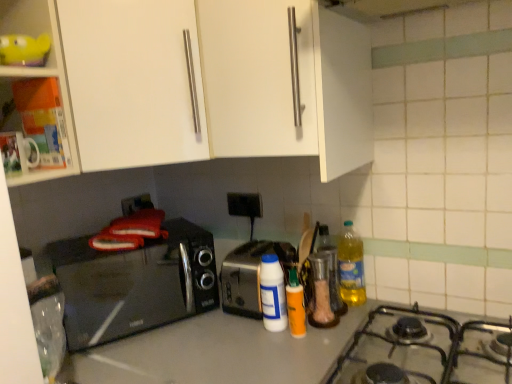
Question: From a real-world perspective, is orange matte bottle at center, the second bottle from the right, positioned above or below yellow translucent bottle at right?

Choices:
 (A) below
 (B) above

Answer: (A)

Question: Considering the positions of point (295, 307) and point (339, 248), is point (295, 307) closer or farther from the camera than point (339, 248)?

Choices:
 (A) farther
 (B) closer

Answer: (B)

Question: Considering the real-world distances, which object is farthest from the silver metallic toaster at center?

Choices:
 (A) smooth gray countertop at center
 (B) translucent plastic bottle at center, the third bottle positioned from the left
 (C) black plastic outlet at center
 (D) orange matte bottle at center, the second bottle from the right
 (E) metallic gray gas stove at lower right

Answer: (E)

Question: Which of these objects is positioned farthest from the white matte cabinet at upper center, positioned as the 3th cabinetry in left-to-right order?

Choices:
 (A) silver metallic toaster at center
 (B) orange matte bottle at center, acting as the 2th bottle starting from the left
 (C) translucent plastic bottle at center, the third bottle positioned from the left
 (D) clear glass container at center
 (E) white plastic bottle at center, the first bottle positioned from the left

Answer: (D)